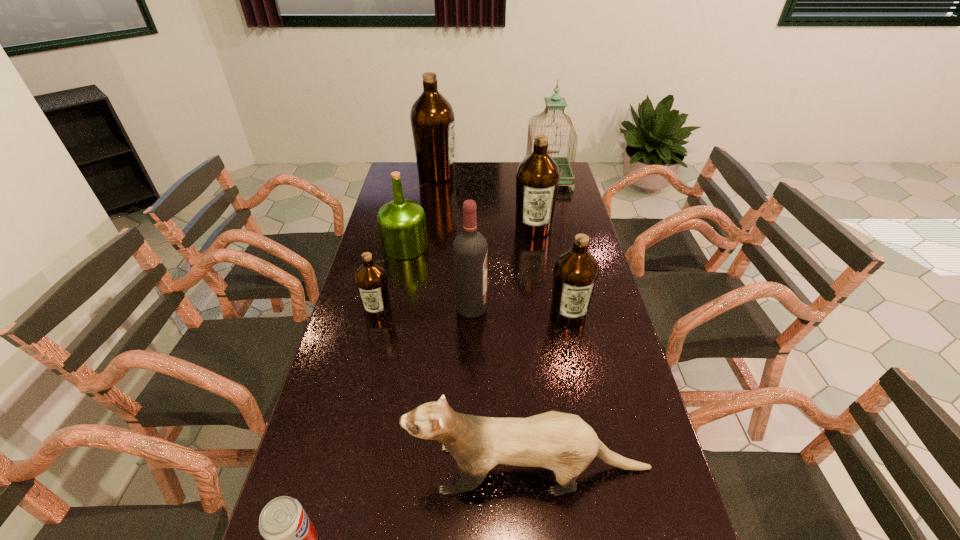
In order to click on vacant position located on the label of the shortest olive oil in this screenshot , I will do `click(356, 401)`.

At what (x,y) coordinates should I click in order to perform the action: click on olive oil at the far edge. Please return your answer as a coordinate pair (x, y). This screenshot has height=540, width=960. Looking at the image, I should click on (432, 118).

You are a GUI agent. You are given a task and a screenshot of the screen. Output one action in this format:
    pyautogui.click(x=<x>, y=<y>)
    Task: Click on the birdcage at the far edge
    
    Given the screenshot: What is the action you would take?
    pyautogui.click(x=555, y=102)

Image resolution: width=960 pixels, height=540 pixels. Find the location of `birdcage at the right edge`. birdcage at the right edge is located at coordinates (555, 102).

At what (x,y) coordinates should I click in order to perform the action: click on ferret at the right edge. Please return your answer as a coordinate pair (x, y). Looking at the image, I should click on (564, 443).

Where is `object that is at the far left corner`? The width and height of the screenshot is (960, 540). object that is at the far left corner is located at coordinates (432, 118).

Image resolution: width=960 pixels, height=540 pixels. I want to click on object that is at the far right corner, so click(x=555, y=102).

This screenshot has width=960, height=540. Find the location of `free location at the far edge`. free location at the far edge is located at coordinates (515, 166).

Find the location of `free region at the left edge`. free region at the left edge is located at coordinates (363, 356).

Find the location of a particular element. The image size is (960, 540). vacant area at the right edge of the desktop is located at coordinates (573, 224).